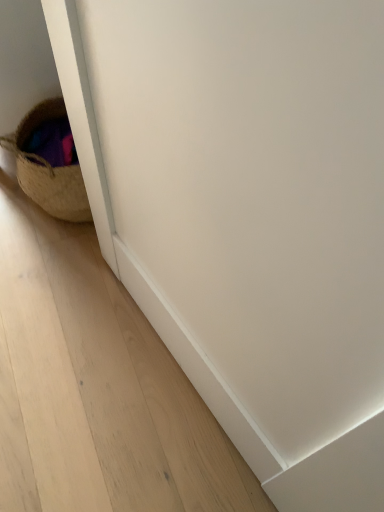
Where is `free space in front of brown woven basket at lower left`? This screenshot has width=384, height=512. free space in front of brown woven basket at lower left is located at coordinates (46, 258).